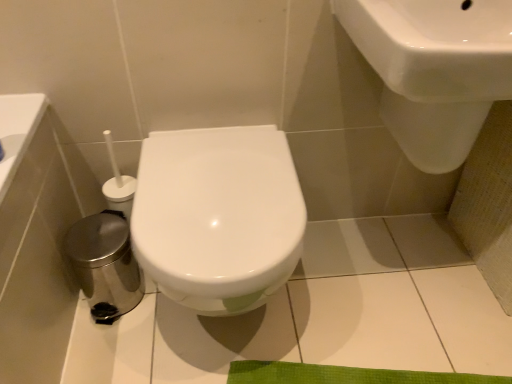
Question: Does white glossy sink at upper right touch white glossy toilet at center?

Choices:
 (A) yes
 (B) no

Answer: (B)

Question: Does white glossy sink at upper right have a greater width compared to white glossy toilet at center?

Choices:
 (A) yes
 (B) no

Answer: (B)

Question: Is white glossy sink at upper right turned away from white glossy toilet at center?

Choices:
 (A) yes
 (B) no

Answer: (B)

Question: Is white glossy toilet at center located within white glossy sink at upper right?

Choices:
 (A) yes
 (B) no

Answer: (B)

Question: Does white glossy sink at upper right have a larger size compared to white glossy toilet at center?

Choices:
 (A) yes
 (B) no

Answer: (B)

Question: From the image's perspective, is white glossy sink at upper right over white glossy toilet at center?

Choices:
 (A) yes
 (B) no

Answer: (A)

Question: Is white glossy toilet at center to the right of white glossy sink at upper right from the viewer's perspective?

Choices:
 (A) no
 (B) yes

Answer: (A)

Question: Is the depth of white glossy toilet at center less than that of white glossy sink at upper right?

Choices:
 (A) no
 (B) yes

Answer: (A)

Question: Does white glossy toilet at center have a lesser width compared to white glossy sink at upper right?

Choices:
 (A) yes
 (B) no

Answer: (B)

Question: Can you confirm if white glossy toilet at center is wider than white glossy sink at upper right?

Choices:
 (A) no
 (B) yes

Answer: (B)

Question: Does white glossy toilet at center have a lesser height compared to white glossy sink at upper right?

Choices:
 (A) no
 (B) yes

Answer: (A)

Question: Would you say white glossy toilet at center contains white glossy sink at upper right?

Choices:
 (A) no
 (B) yes

Answer: (A)

Question: Is white glossy toilet at center inside the boundaries of white glossy sink at upper right, or outside?

Choices:
 (A) inside
 (B) outside

Answer: (B)